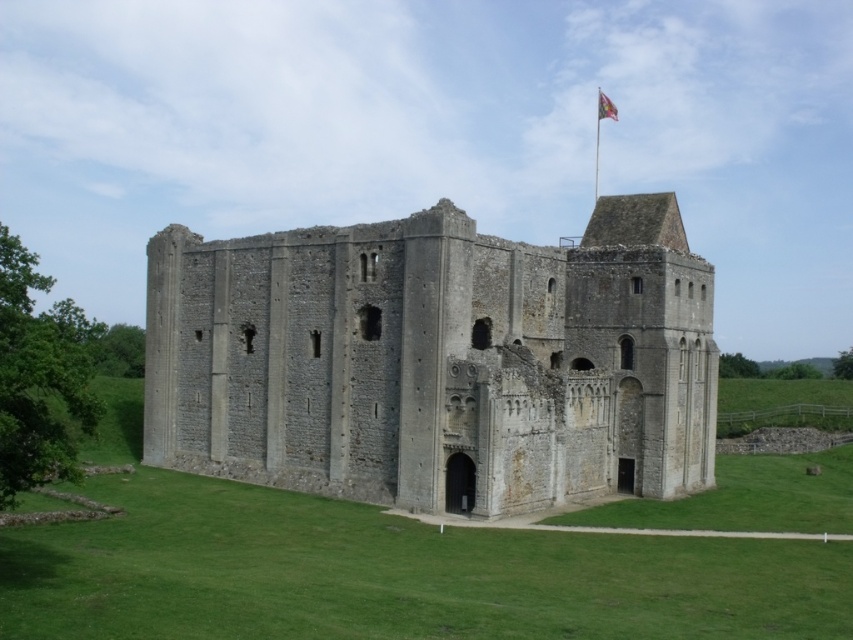
You are a historian examining the image of the gray stone castle at center and the silky fabric flag at upper right. Based on the visual evidence, which object occupies a greater horizontal space in the image?

The gray stone castle at center has a larger width than the silky fabric flag at upper right, so it occupies more horizontal space.